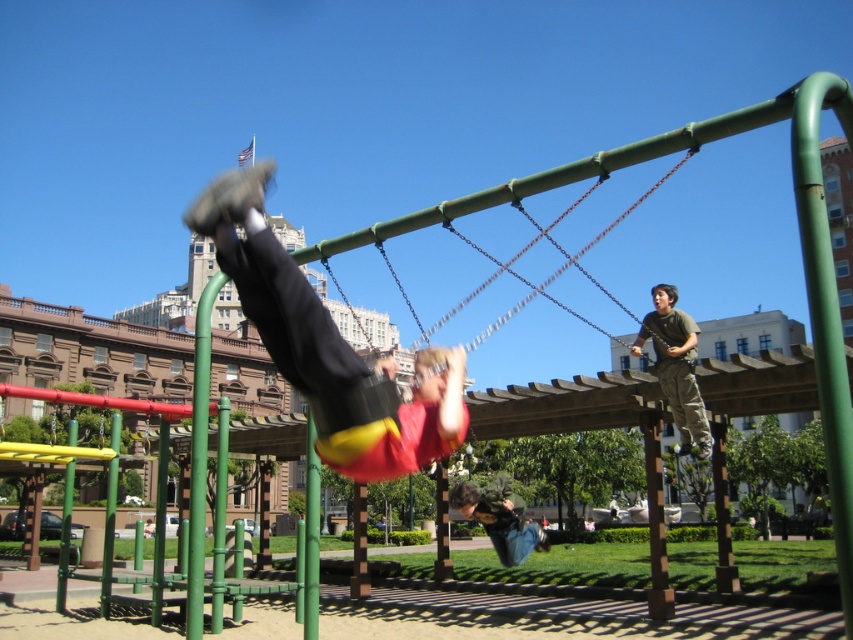
Question: Which object is positioned closest to the matte yellow pants at center?

Choices:
 (A) green matte pole at center
 (B) denim jeans at lower center
 (C) green camouflage pants at upper right

Answer: (A)

Question: Which object appears closest to the camera in this image?

Choices:
 (A) green camouflage pants at upper right
 (B) denim jeans at lower center
 (C) matte yellow pants at center
 (D) green matte pole at center

Answer: (C)

Question: Which is nearer to the green camouflage pants at upper right?

Choices:
 (A) matte yellow pants at center
 (B) green matte pole at center
 (C) denim jeans at lower center

Answer: (C)

Question: Can you confirm if green camouflage pants at upper right is thinner than green matte pole at center?

Choices:
 (A) yes
 (B) no

Answer: (B)

Question: Can you confirm if matte yellow pants at center is wider than green camouflage pants at upper right?

Choices:
 (A) yes
 (B) no

Answer: (A)

Question: Is denim jeans at lower center positioned in front of green matte pole at center?

Choices:
 (A) yes
 (B) no

Answer: (B)